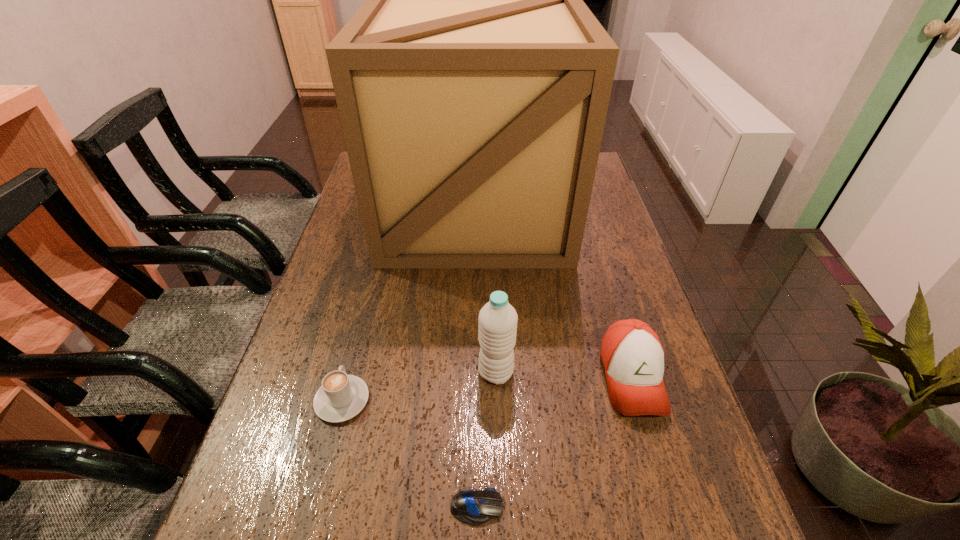
The image size is (960, 540). Find the location of `object at the far right corner`. object at the far right corner is located at coordinates (473, 84).

Identify the location of vacant space at the left edge. Image resolution: width=960 pixels, height=540 pixels. (291, 429).

Locate an element on the screen. The width and height of the screenshot is (960, 540). vacant space at the right edge of the desktop is located at coordinates (661, 494).

You are a GUI agent. You are given a task and a screenshot of the screen. Output one action in this format:
    pyautogui.click(x=<x>, y=<y>)
    Task: Click on the free space between the third shortest object and the water bottle
    Image resolution: width=960 pixels, height=540 pixels.
    Given the screenshot: What is the action you would take?
    pyautogui.click(x=564, y=375)

Identify the location of blank region between the cappuccino and the water bottle. (419, 386).

Locate an element on the screen. The height and width of the screenshot is (540, 960). vacant space that's between the fourth tallest object and the third shortest object is located at coordinates (487, 389).

At what (x,y) coordinates should I click in order to perform the action: click on empty space between the nearest object and the second shortest object. Please return your answer as a coordinate pair (x, y). This screenshot has height=540, width=960. Looking at the image, I should click on (409, 454).

Identify the location of unoccupied area between the nearest object and the fourth tallest object. Image resolution: width=960 pixels, height=540 pixels. (409, 454).

At what (x,y) coordinates should I click in order to perform the action: click on free spot between the second tallest object and the third tallest object. Please return your answer as a coordinate pair (x, y). Looking at the image, I should click on (564, 375).

At what (x,y) coordinates should I click in order to perform the action: click on empty space that is in between the baseball cap and the water bottle. Please return your answer as a coordinate pair (x, y). Looking at the image, I should click on (564, 375).